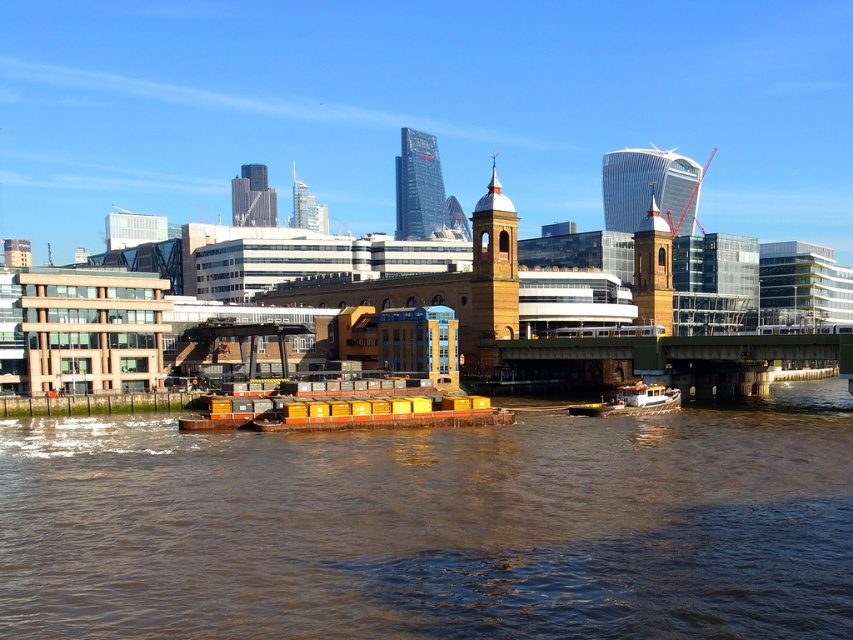
Question: Which object is closer to the camera taking this photo?

Choices:
 (A) brown muddy water at center
 (B) yellow matte container ship at center
 (C) concrete bridge at center

Answer: (A)

Question: Can you confirm if brown muddy water at center is bigger than yellow matte container ship at center?

Choices:
 (A) yes
 (B) no

Answer: (A)

Question: Among these points, which one is farthest from the camera?

Choices:
 (A) (751, 364)
 (B) (650, 401)

Answer: (A)

Question: Which of the following is the farthest from the observer?

Choices:
 (A) (656, 406)
 (B) (277, 496)
 (C) (410, 387)
 (D) (799, 340)

Answer: (C)

Question: Is concrete bridge at center closer to the viewer compared to white wooden boat at center?

Choices:
 (A) no
 (B) yes

Answer: (A)

Question: Does concrete bridge at center have a lesser width compared to white wooden boat at center?

Choices:
 (A) yes
 (B) no

Answer: (B)